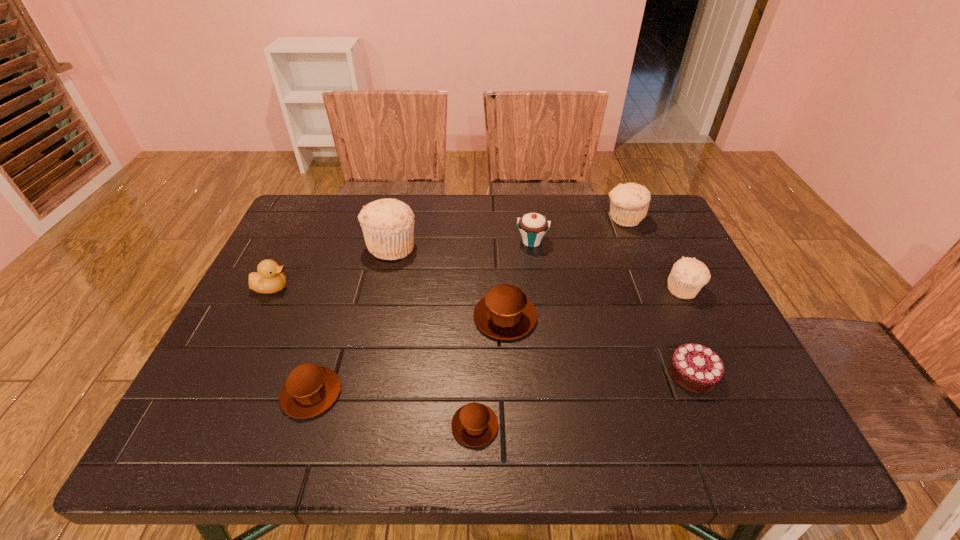
Find the location of a particular element. The height and width of the screenshot is (540, 960). blank space that satisfies the following two spatial constraints: 1. on the back side of the smallest beige muffin; 2. on the right side of the farthest brown muffin is located at coordinates (504, 289).

This screenshot has height=540, width=960. Identify the location of vacant space that satisfies the following two spatial constraints: 1. on the front side of the fifth shortest muffin; 2. facing forward on the duckling. (653, 287).

At what (x,y) coordinates should I click in order to perform the action: click on vacant area in the image that satisfies the following two spatial constraints: 1. on the back side of the second biggest beige muffin; 2. on the left side of the tallest muffin. Please return your answer as a coordinate pair (x, y). Looking at the image, I should click on (397, 219).

Where is `free spot that satisfies the following two spatial constraints: 1. facing forward on the chocolate chocolate cake; 2. on the left side of the duckling`? The width and height of the screenshot is (960, 540). free spot that satisfies the following two spatial constraints: 1. facing forward on the chocolate chocolate cake; 2. on the left side of the duckling is located at coordinates [x=229, y=374].